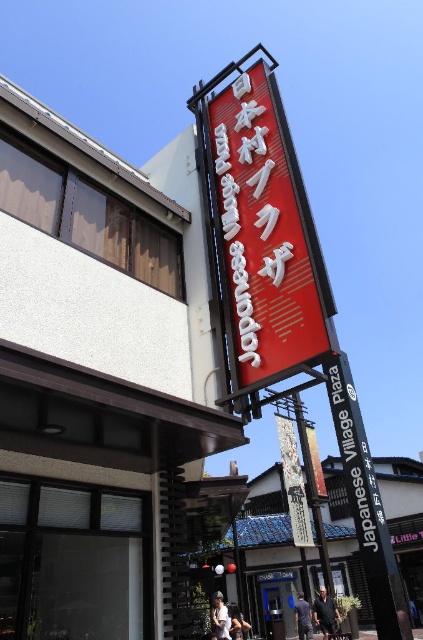
Question: Which is nearer to the blue fabric shirt at lower center?

Choices:
 (A) black metal sign at center
 (B) dark blue jeans at center
 (C) red matte sign at upper center
 (D) white cotton shirt at lower center

Answer: (B)

Question: Can you confirm if black metal sign at center is wider than white cotton shirt at lower center?

Choices:
 (A) yes
 (B) no

Answer: (B)

Question: Among these objects, which one is nearest to the camera?

Choices:
 (A) blue fabric shirt at lower center
 (B) white paper sign at center
 (C) red matte sign at upper center

Answer: (C)

Question: Is red matte sign at upper center wider than white cotton shirt at lower center?

Choices:
 (A) yes
 (B) no

Answer: (A)

Question: Is black metal sign at center wider than blue fabric shirt at lower center?

Choices:
 (A) no
 (B) yes

Answer: (A)

Question: Which object is closer to the camera taking this photo?

Choices:
 (A) white cotton shirt at lower center
 (B) dark blue jeans at center

Answer: (A)